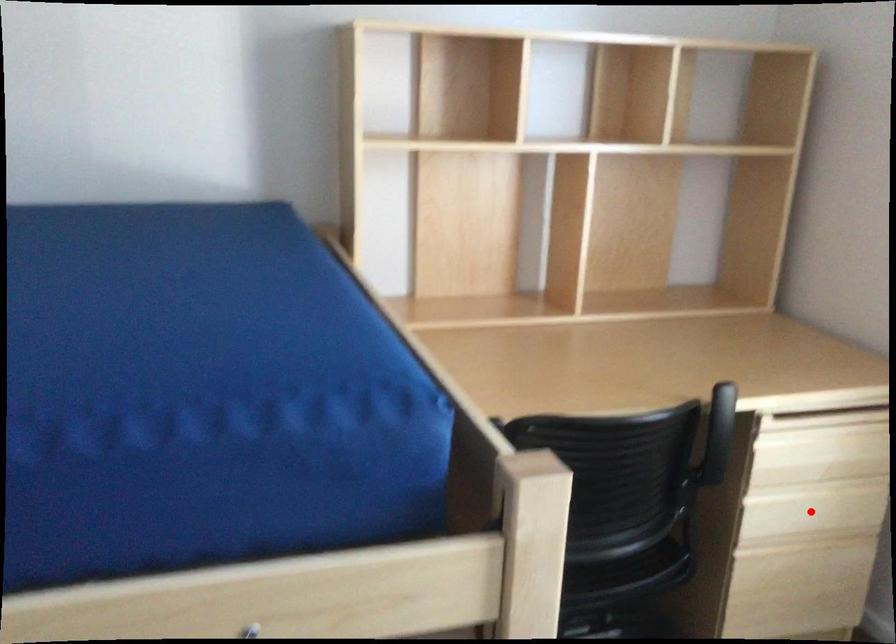
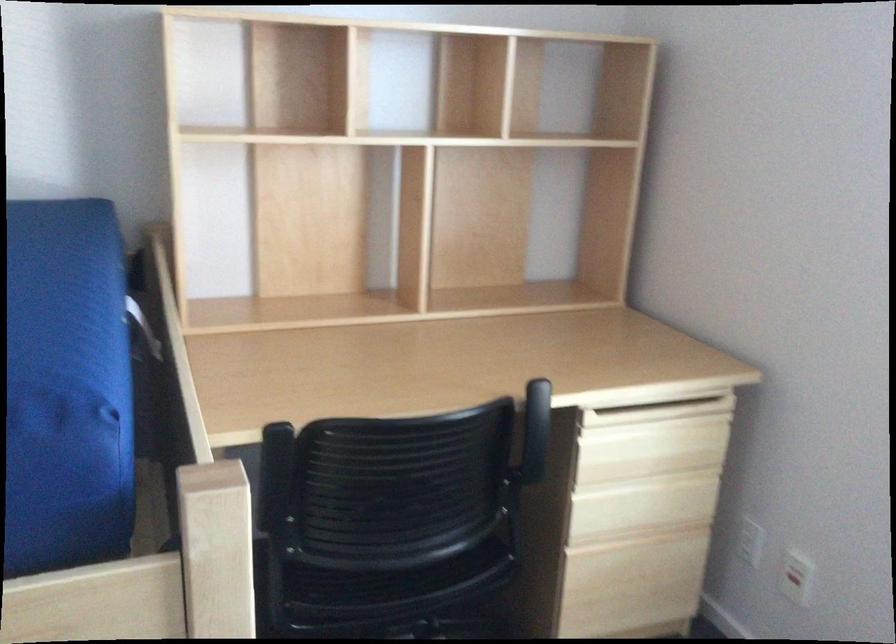
Find the pixel in the second image that matches the highlighted location in the first image.

(642, 506)